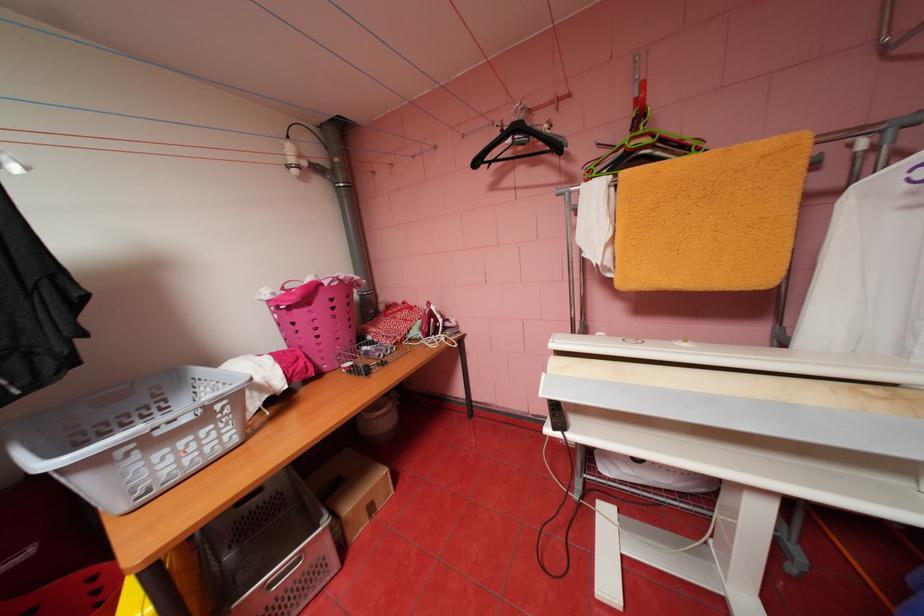
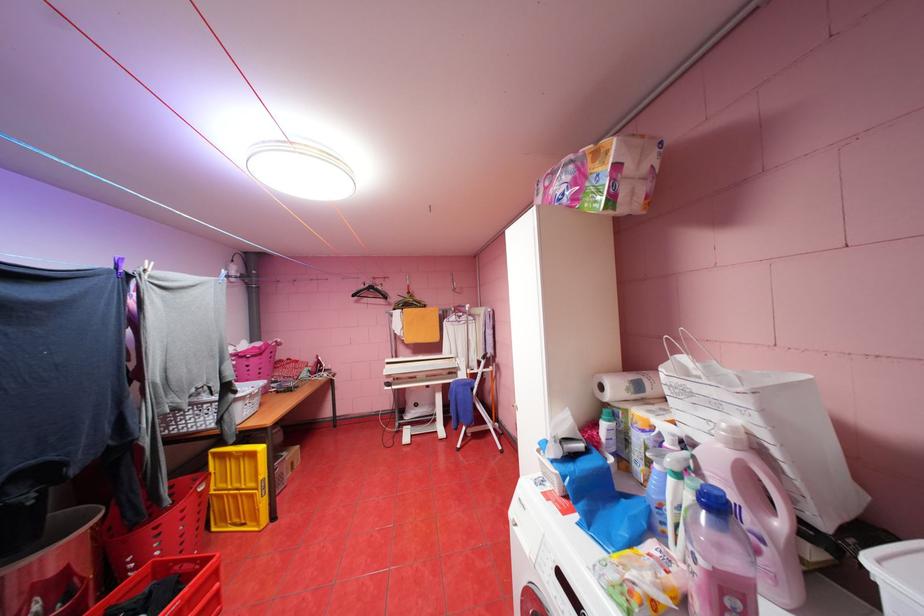
The point at (484, 163) is marked in the first image. Where is the corresponding point in the second image?

(361, 294)